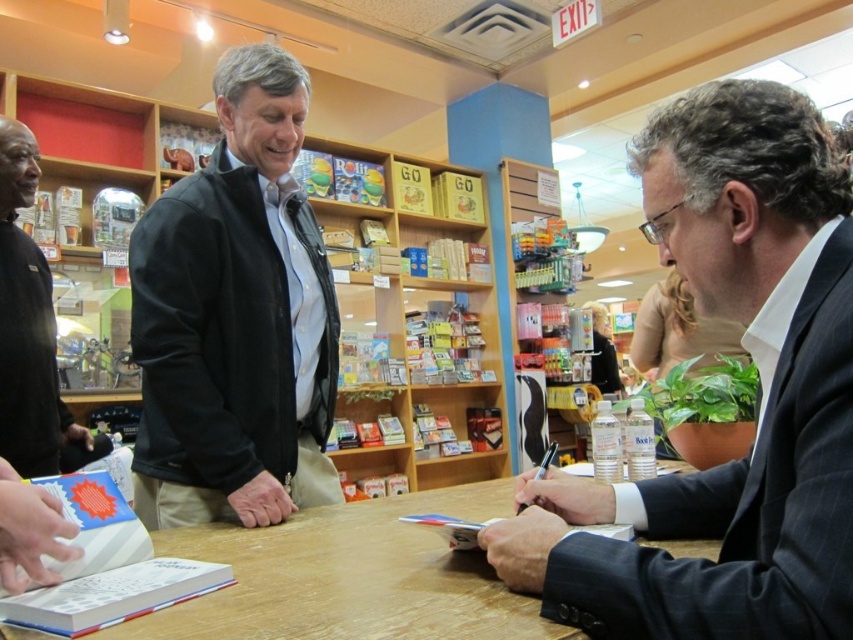
You are organizing a book signing event and need to place a 1.2 meter long banner between the wooden table at center and the black matte shirt at left. Is there enough space between them to fit the banner without bending it?

The wooden table at center is 1.06 meters from the black matte shirt at left, so the banner cannot be placed straight between them because it is longer than the available space.

Looking at this image, you are attending a book signing event and need to reach the wooden bookshelf at center to pick up a book. However, there is a person in a black matte shirt at left blocking your path. Based on the scene description, can you walk around the person to reach the bookshelf?

The wooden bookshelf at center is positioned on the right side of black matte shirt at left, so you can walk around the person in the black matte shirt at left to reach the wooden bookshelf at center since it is to their right.